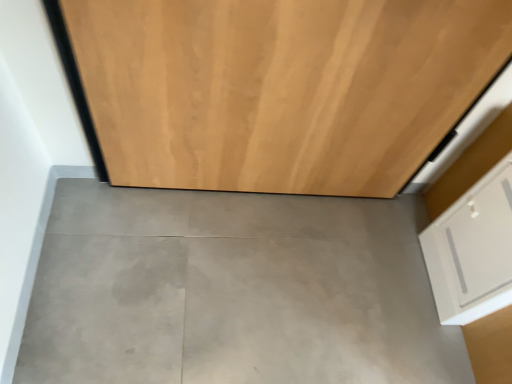
Describe the element at coordinates (281, 88) in the screenshot. I see `wooden door at center` at that location.

You are a GUI agent. You are given a task and a screenshot of the screen. Output one action in this format:
    pyautogui.click(x=<x>, y=<y>)
    Task: Click on the gray concrete floor at center
    The image size is (512, 384).
    Given the screenshot: What is the action you would take?
    pyautogui.click(x=233, y=291)

The width and height of the screenshot is (512, 384). Describe the element at coordinates (473, 250) in the screenshot. I see `white matte drawer at lower right` at that location.

Where is `wooden door at center`? The height and width of the screenshot is (384, 512). wooden door at center is located at coordinates (281, 88).

From the image's perspective, which object appears higher, gray concrete floor at center or white matte drawer at lower right?

white matte drawer at lower right, from the image's perspective.

Is gray concrete floor at center situated inside white matte drawer at lower right or outside?

gray concrete floor at center is spatially situated outside white matte drawer at lower right.

Looking at the image, does gray concrete floor at center seem bigger or smaller compared to white matte drawer at lower right?

In the image, gray concrete floor at center appears to be larger than white matte drawer at lower right.

Can you confirm if gray concrete floor at center is thinner than white matte drawer at lower right?

In fact, gray concrete floor at center might be wider than white matte drawer at lower right.

Considering the sizes of objects white matte drawer at lower right and gray concrete floor at center in the image provided, who is bigger, white matte drawer at lower right or gray concrete floor at center?

With larger size is gray concrete floor at center.

Considering the positions of objects white matte drawer at lower right and gray concrete floor at center in the image provided, who is more to the right, white matte drawer at lower right or gray concrete floor at center?

white matte drawer at lower right.

Considering the relative sizes of white matte drawer at lower right and gray concrete floor at center in the image provided, is white matte drawer at lower right wider than gray concrete floor at center?

In fact, white matte drawer at lower right might be narrower than gray concrete floor at center.

Can you tell me how much white matte drawer at lower right and gray concrete floor at center differ in facing direction?

The angle between the facing direction of white matte drawer at lower right and the facing direction of gray concrete floor at center is 91.9 degrees.

From the picture: In the image, is wooden door at center positioned in front of or behind white matte drawer at lower right?

Clearly, wooden door at center is in front of white matte drawer at lower right.

From a real-world perspective, is wooden door at center above or below white matte drawer at lower right?

wooden door at center is above white matte drawer at lower right.

Is point (480, 40) more distant than point (457, 282)?

That is False.

In the scene shown: From the image's perspective, between wooden door at center and white matte drawer at lower right, which one is located above?

wooden door at center.

Which is more to the right, wooden door at center or gray concrete floor at center?

wooden door at center.

From the picture: Is wooden door at center surrounding gray concrete floor at center?

No.

How different are the orientations of wooden door at center and gray concrete floor at center in degrees?

They differ by 179 degrees in their facing directions.

Can you confirm if wooden door at center is thinner than gray concrete floor at center?

Correct, the width of wooden door at center is less than that of gray concrete floor at center.

How distant is white matte drawer at lower right from wooden door at center?

white matte drawer at lower right and wooden door at center are 19.24 inches apart from each other.

Do you think white matte drawer at lower right is within wooden door at center, or outside of it?

white matte drawer at lower right is not inside wooden door at center, it's outside.

In terms of size, does white matte drawer at lower right appear bigger or smaller than wooden door at center?

Clearly, white matte drawer at lower right is smaller in size than wooden door at center.

Visually, is white matte drawer at lower right positioned to the left or to the right of wooden door at center?

white matte drawer at lower right is to the right of wooden door at center.

Which of these two, gray concrete floor at center or wooden door at center, is thinner?

Thinner between the two is wooden door at center.

Based on the photo, can you confirm if gray concrete floor at center is smaller than wooden door at center?

→ Yes, gray concrete floor at center is smaller than wooden door at center.

From the image's perspective, would you say gray concrete floor at center is positioned over wooden door at center?

Actually, gray concrete floor at center appears below wooden door at center in the image.

Is there a large distance between gray concrete floor at center and wooden door at center?

That's not correct — gray concrete floor at center is a little close to wooden door at center.

Find the location of a particular element. The height and width of the screenshot is (384, 512). drawer on the right of gray concrete floor at center is located at coordinates (473, 250).

I want to click on drawer above the gray concrete floor at center (from a real-world perspective), so coord(473,250).

When comparing their distances from white matte drawer at lower right, does gray concrete floor at center or wooden door at center seem further?

The object further to white matte drawer at lower right is wooden door at center.

Considering their positions, is gray concrete floor at center positioned further to wooden door at center than white matte drawer at lower right?

Based on the image, white matte drawer at lower right appears to be further to wooden door at center.

Looking at the image, which one is located further to gray concrete floor at center, white matte drawer at lower right or wooden door at center?

Among the two, white matte drawer at lower right is located further to gray concrete floor at center.

When comparing their distances from wooden door at center, does white matte drawer at lower right or gray concrete floor at center seem closer?

The object closer to wooden door at center is gray concrete floor at center.

Which object lies further to the anchor point gray concrete floor at center, wooden door at center or white matte drawer at lower right?

white matte drawer at lower right is further to gray concrete floor at center.

From the image, which object appears to be farther from white matte drawer at lower right, wooden door at center or gray concrete floor at center?

wooden door at center.

Locate an element on the screen. door between gray concrete floor at center and white matte drawer at lower right is located at coordinates (281, 88).